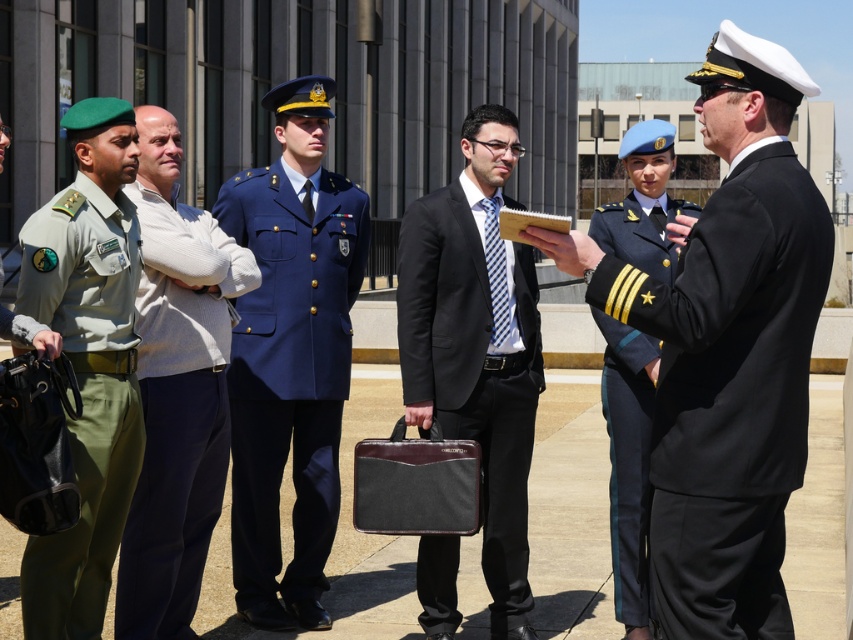
Question: Estimate the real-world distances between objects in this image. Which object is farther from the shiny blue uniform at center?

Choices:
 (A) navy blue fabric uniform at center
 (B) light beige sweater at center

Answer: (B)

Question: Can you confirm if navy blue fabric uniform at right is positioned to the left of black fabric briefcase at center?

Choices:
 (A) yes
 (B) no

Answer: (B)

Question: Which of the following is the closest to the observer?

Choices:
 (A) shiny blue uniform at center
 (B) light beige sweater at center
 (C) black fabric briefcase at center
 (D) navy blue fabric uniform at center

Answer: (A)

Question: Is light beige sweater at center thinner than green fabric uniform at left?

Choices:
 (A) yes
 (B) no

Answer: (B)

Question: Does navy blue fabric uniform at center appear over shiny blue uniform at center?

Choices:
 (A) no
 (B) yes

Answer: (B)

Question: Among these objects, which one is farthest from the camera?

Choices:
 (A) light beige sweater at center
 (B) black fabric briefcase at center
 (C) navy blue fabric uniform at center
 (D) navy blue fabric uniform at right

Answer: (C)